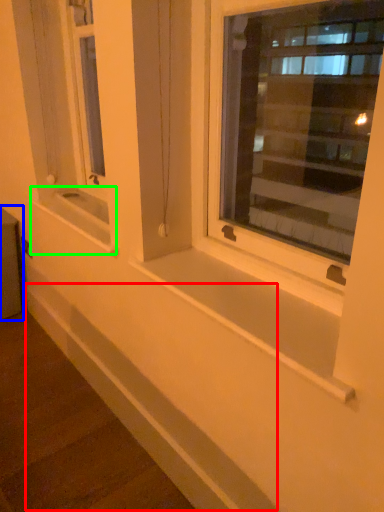
Question: Which is nearer to the ledge (highlighted by a red box)? window box (highlighted by a blue box) or window sill (highlighted by a green box).

Choices:
 (A) window box
 (B) window sill

Answer: (B)